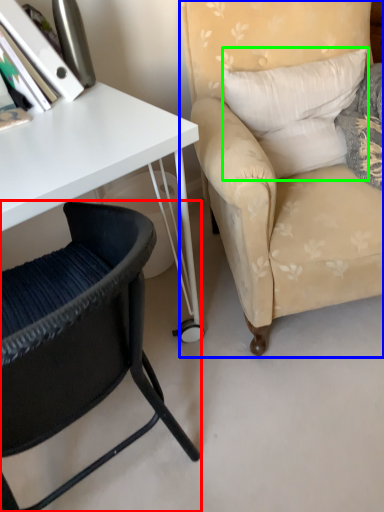
Question: Considering the real-world distances, which object is closest to chair (highlighted by a red box)? chair (highlighted by a blue box) or pillow (highlighted by a green box).

Choices:
 (A) chair
 (B) pillow

Answer: (A)